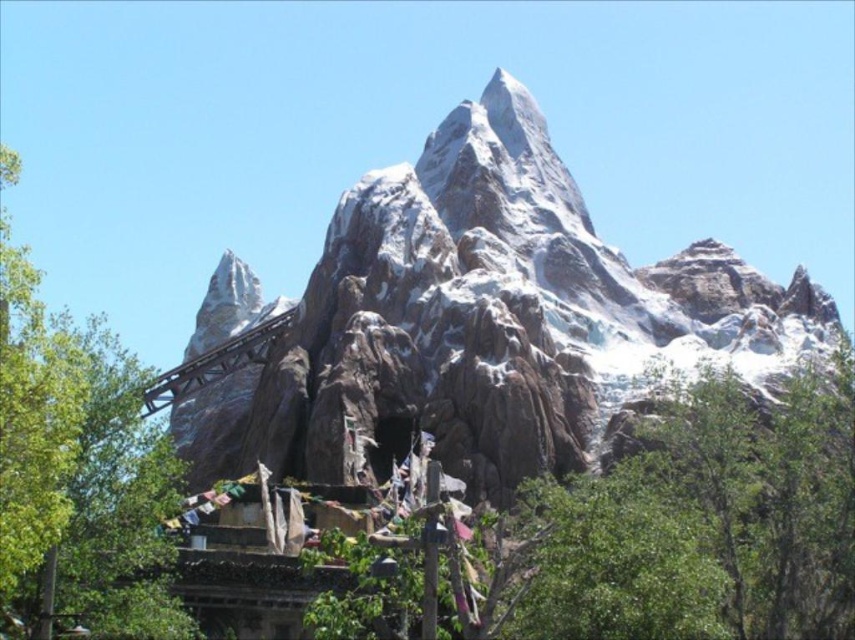
Can you confirm if green leafy tree at center is positioned to the left of green leafy tree at left?

No, green leafy tree at center is not to the left of green leafy tree at left.

Does green leafy tree at center appear on the right side of green leafy tree at left?

Yes, green leafy tree at center is to the right of green leafy tree at left.

The height and width of the screenshot is (640, 855). Identify the location of green leafy tree at center. (697, 520).